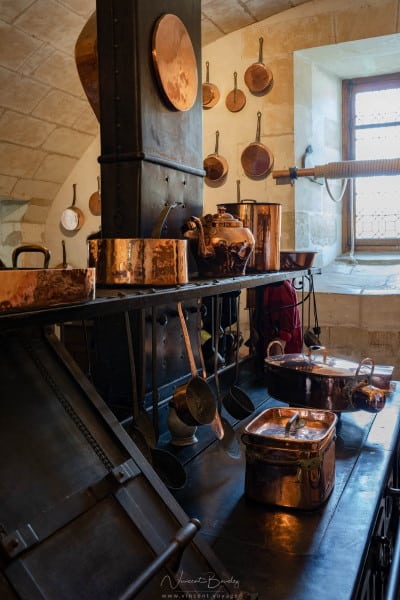
I want to click on wall, so click(367, 321), click(49, 125), click(220, 194), click(87, 165).